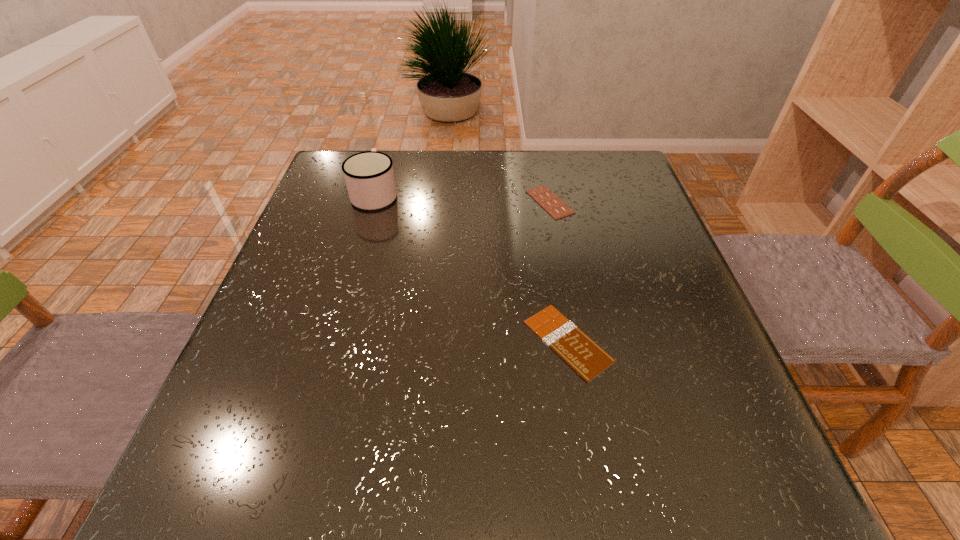
I want to click on vacant space that satisfies the following two spatial constraints: 1. on the back side of the second shortest object; 2. on the left side of the nearest object, so click(544, 202).